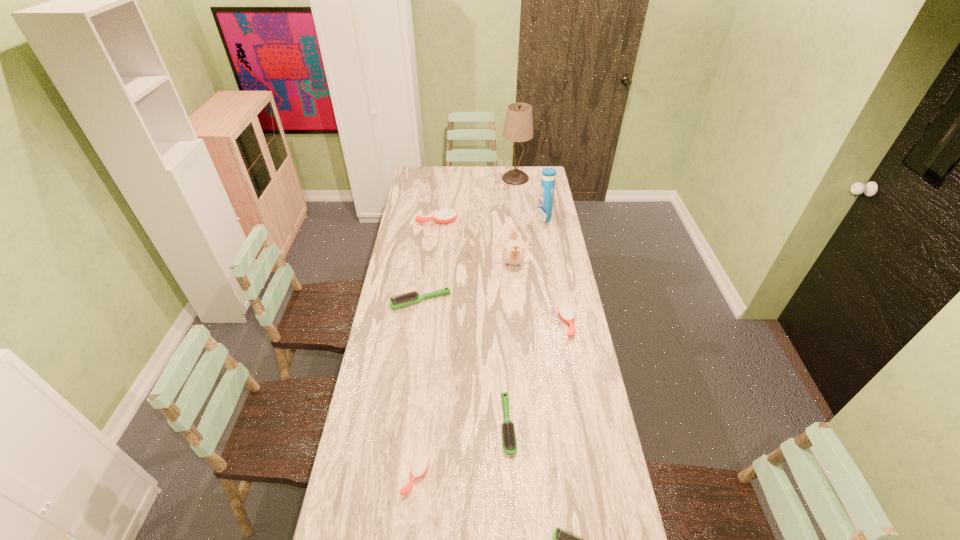
Locate an element on the screen. The width and height of the screenshot is (960, 540). object present at the far right corner is located at coordinates (518, 127).

I want to click on vacant space at the far edge of the desktop, so click(x=458, y=178).

Locate an element on the screen. The height and width of the screenshot is (540, 960). vacant space at the left edge is located at coordinates (391, 279).

You are a GUI agent. You are given a task and a screenshot of the screen. Output one action in this format:
    pyautogui.click(x=<x>, y=<y>)
    Task: Click on the blank space at the right edge of the desktop
    The image size is (960, 540).
    Given the screenshot: What is the action you would take?
    pyautogui.click(x=551, y=308)

Image resolution: width=960 pixels, height=540 pixels. I want to click on blank space at the far left corner, so click(415, 171).

Locate an element on the screen. This screenshot has width=960, height=540. vacant space that is in between the second farthest orange hairbrush and the fourth farthest hairbrush is located at coordinates (538, 374).

Where is `free space between the biggest orange hairbrush and the rightmost orange hairbrush`? The height and width of the screenshot is (540, 960). free space between the biggest orange hairbrush and the rightmost orange hairbrush is located at coordinates (502, 272).

Identify the location of vacant region between the second biggest light hairbrush and the farthest hairbrush. (472, 323).

Where is `vacant area that lies between the second light hairbrush from left to right and the bird`? The image size is (960, 540). vacant area that lies between the second light hairbrush from left to right and the bird is located at coordinates (511, 346).

Find the location of a particular element. empty location between the third tallest object and the third hairbrush from right to left is located at coordinates (511, 346).